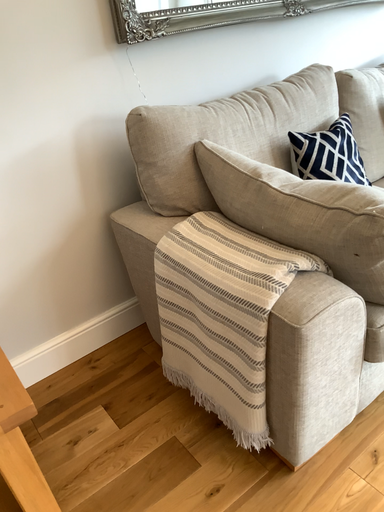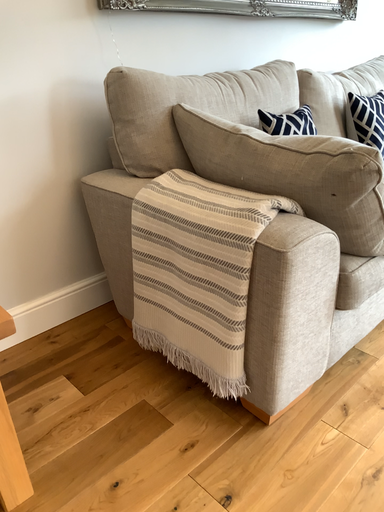
Question: How did the camera likely rotate when shooting the video?

Choices:
 (A) rotated left
 (B) rotated right

Answer: (B)